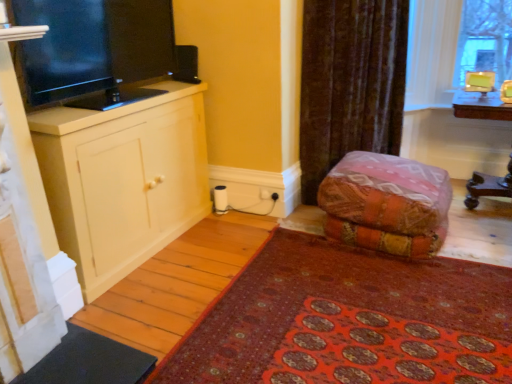
Question: Should I look upward or downward to see wooden table at right?

Choices:
 (A) down
 (B) up

Answer: (B)

Question: From a real-world perspective, is red carpet at lower right positioned over wooden table at right based on gravity?

Choices:
 (A) yes
 (B) no

Answer: (B)

Question: Is red carpet at lower right wider than wooden table at right?

Choices:
 (A) yes
 (B) no

Answer: (A)

Question: Is red carpet at lower right completely or partially outside of wooden table at right?

Choices:
 (A) no
 (B) yes

Answer: (B)

Question: Considering the relative sizes of red carpet at lower right and wooden table at right in the image provided, is red carpet at lower right thinner than wooden table at right?

Choices:
 (A) yes
 (B) no

Answer: (B)

Question: From the image's perspective, is red carpet at lower right beneath wooden table at right?

Choices:
 (A) yes
 (B) no

Answer: (A)

Question: Is red carpet at lower right positioned in front of wooden table at right?

Choices:
 (A) no
 (B) yes

Answer: (B)

Question: Is black glossy tv at left thinner than textured orange fabric at center?

Choices:
 (A) no
 (B) yes

Answer: (B)

Question: Is black glossy tv at left smaller than textured orange fabric at center?

Choices:
 (A) yes
 (B) no

Answer: (A)

Question: Is black glossy tv at left positioned before textured orange fabric at center?

Choices:
 (A) yes
 (B) no

Answer: (A)

Question: Is black glossy tv at left bigger than textured orange fabric at center?

Choices:
 (A) yes
 (B) no

Answer: (B)

Question: From a real-world perspective, is black glossy tv at left physically above textured orange fabric at center?

Choices:
 (A) no
 (B) yes

Answer: (B)

Question: Does black glossy tv at left have a greater width compared to textured orange fabric at center?

Choices:
 (A) no
 (B) yes

Answer: (A)

Question: Does black glossy tv at left have a greater width compared to red carpet at lower right?

Choices:
 (A) yes
 (B) no

Answer: (B)